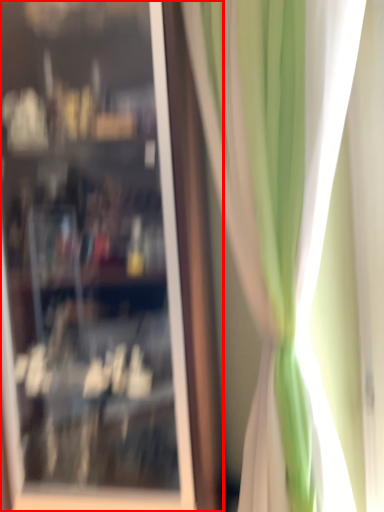
Question: From the image's perspective, where is shop window (annotated by the red box) located relative to curtain?

Choices:
 (A) above
 (B) below

Answer: (A)